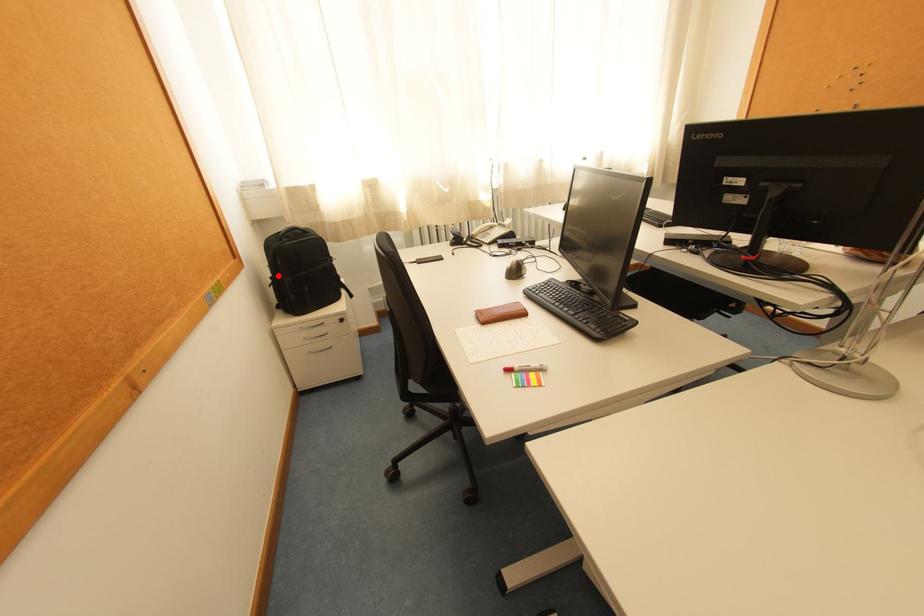
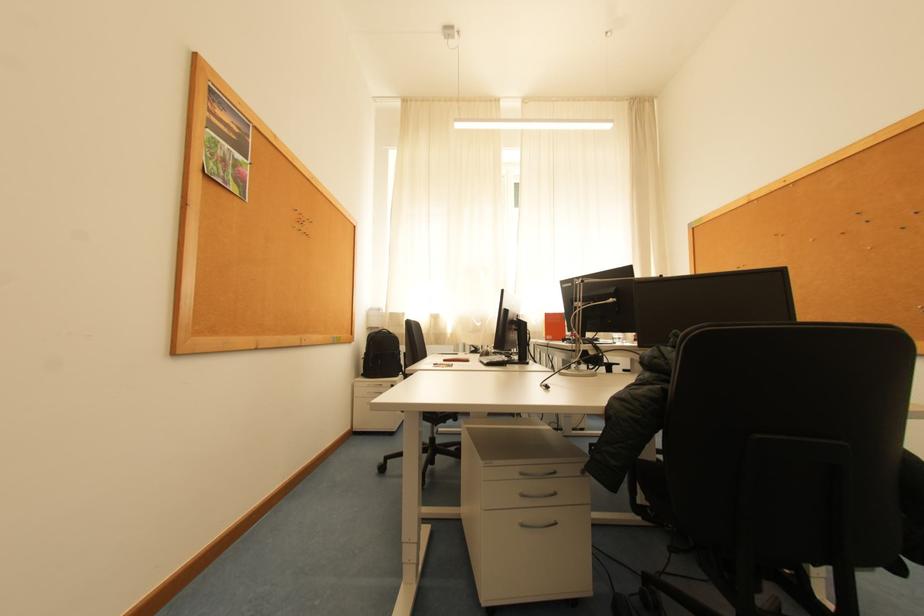
In the second image, find the point that corresponds to the highlighted location in the first image.

(372, 353)